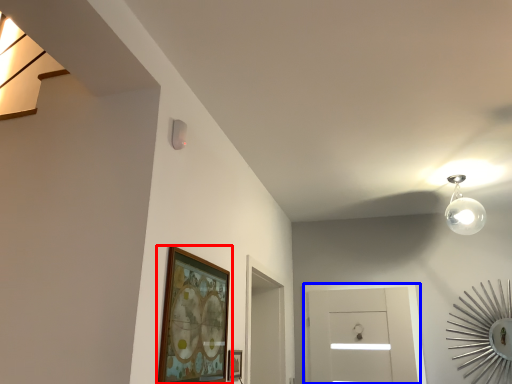
Question: Which object appears closest to the camera in this image, picture frame (highlighted by a red box) or glass door (highlighted by a blue box)?

Choices:
 (A) picture frame
 (B) glass door

Answer: (A)